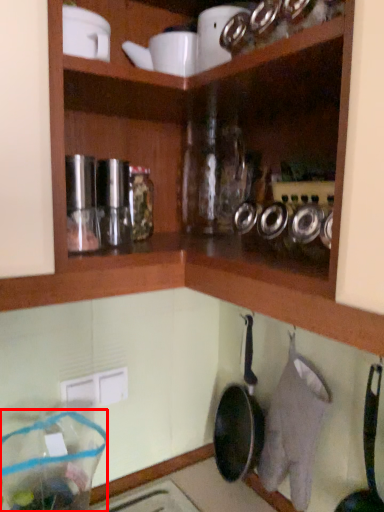
Question: Considering the relative positions of glass jar (annotated by the red box) and frying pan in the image provided, where is glass jar (annotated by the red box) located with respect to the staircase?

Choices:
 (A) left
 (B) right

Answer: (A)